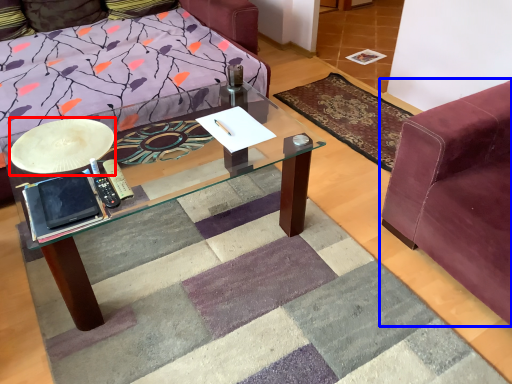
Question: Which object appears closest to the camera in this image, round table (highlighted by a red box) or studio couch (highlighted by a blue box)?

Choices:
 (A) round table
 (B) studio couch

Answer: (B)